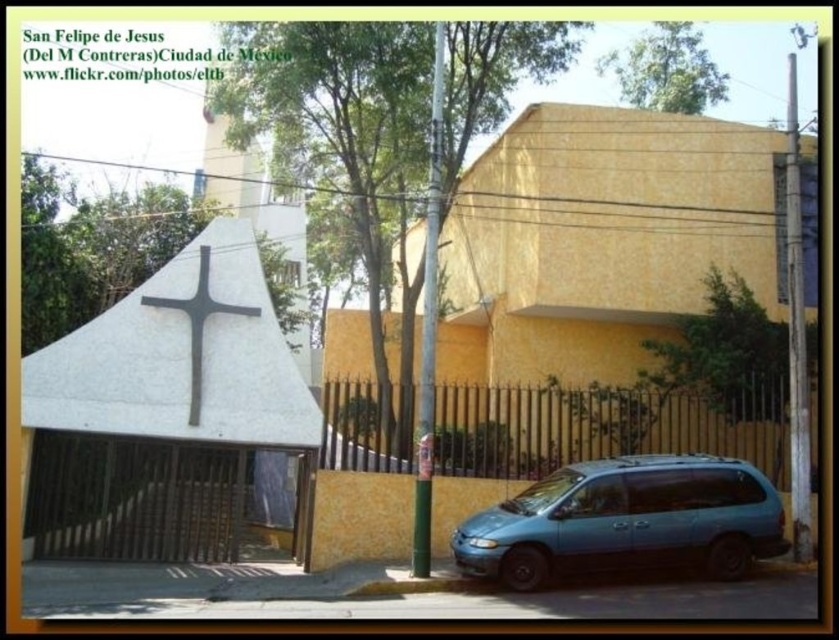
You are a tourist in San Felipe de J? as? visiting the church and the residential building. You notice the white concrete cross at center and the teal matte minivan at lower right. Which object is located higher in the image?

The white concrete cross at center is positioned over the teal matte minivan at lower right, so it is higher in the image.

You are standing in front of the yellow stucco chapel at center in San Felipe de J s, and you want to move to the teal matte minivan at lower right. Can you walk directly to it without going around the chapel?

The teal matte minivan at lower right is behind the yellow stucco chapel at center, so you will need to go around the chapel to reach it.

You are a photographer standing in front of the yellow stucco chapel at center and the teal matte minivan at lower right. You want to take a photo that includes both objects in the frame. Based on their positions, which object should you focus on first to ensure both are visible?

The yellow stucco chapel at center is above the teal matte minivan at lower right, so you should focus on the teal matte minivan at lower right first to ensure both are visible in the frame.